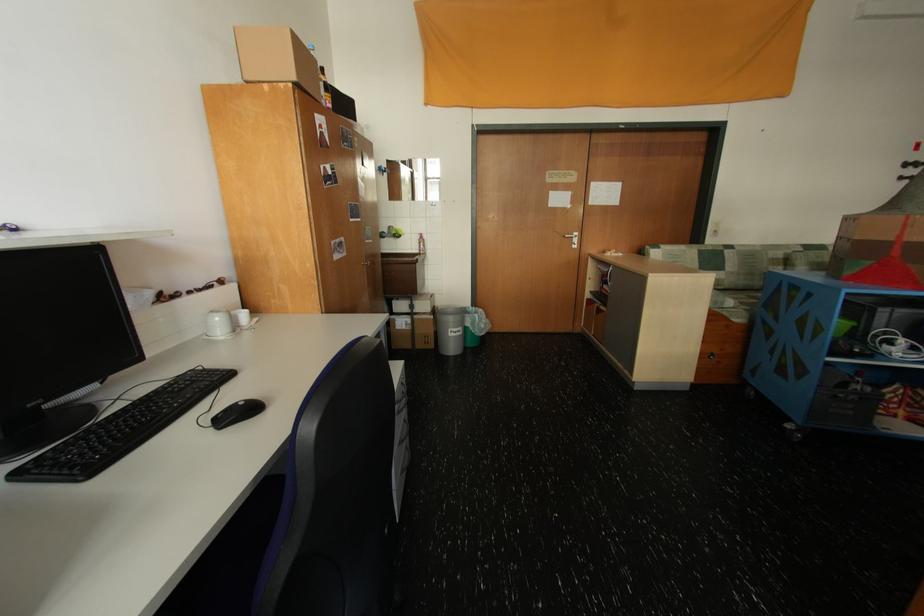
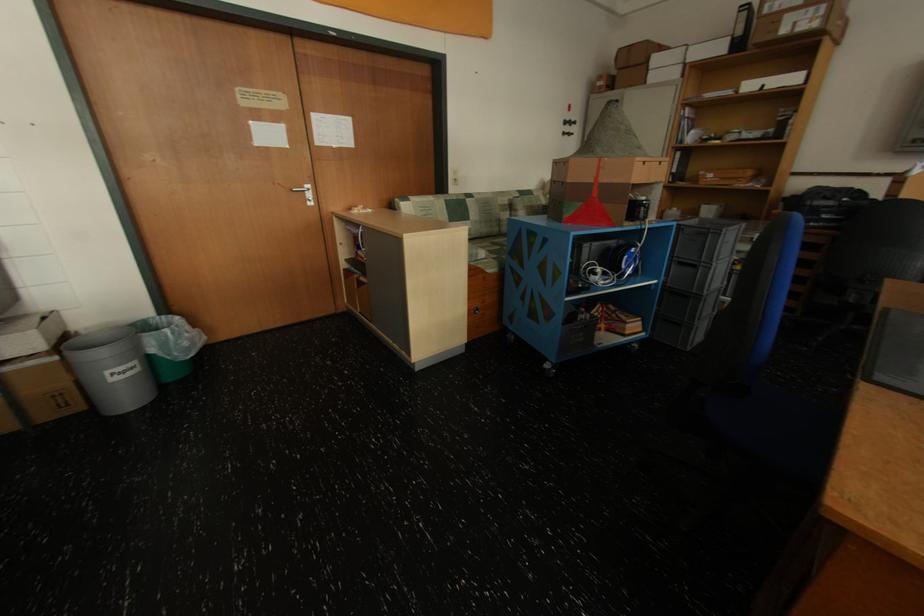
Locate, in the second image, the point that corresponds to point (484, 315) in the first image.

(176, 331)